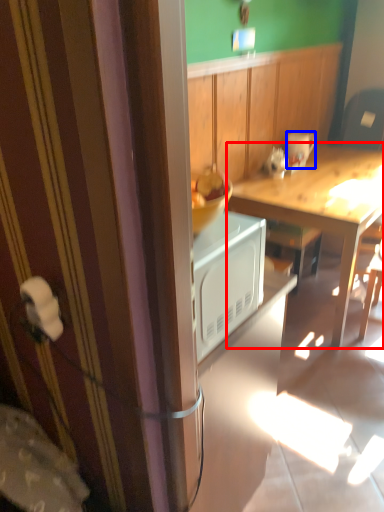
Question: Which point is further to the camera, desk (highlighted by a red box) or coffee cup (highlighted by a blue box)?

Choices:
 (A) desk
 (B) coffee cup

Answer: (B)